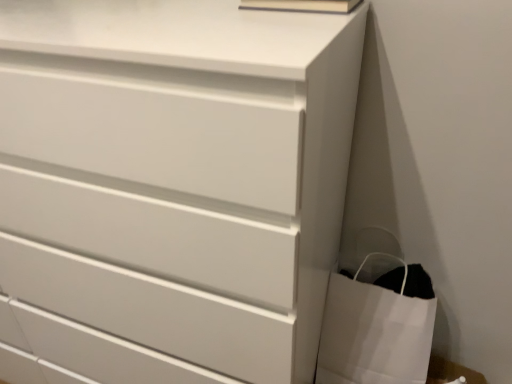
Question: Is white paper bag at lower right inside or outside of white matte chest of drawers at center?

Choices:
 (A) inside
 (B) outside

Answer: (B)

Question: Looking at the image, does white paper bag at lower right seem bigger or smaller compared to white matte chest of drawers at center?

Choices:
 (A) big
 (B) small

Answer: (B)

Question: Is white paper bag at lower right in front of or behind white matte chest of drawers at center in the image?

Choices:
 (A) behind
 (B) front

Answer: (A)

Question: From a real-world perspective, relative to white paper bag at lower right, is white matte chest of drawers at center vertically above or below?

Choices:
 (A) above
 (B) below

Answer: (A)

Question: Looking at the image, does white matte chest of drawers at center seem bigger or smaller compared to white paper bag at lower right?

Choices:
 (A) big
 (B) small

Answer: (A)

Question: From their relative heights in the image, would you say white matte chest of drawers at center is taller or shorter than white paper bag at lower right?

Choices:
 (A) tall
 (B) short

Answer: (A)

Question: Do you think white matte chest of drawers at center is within white paper bag at lower right, or outside of it?

Choices:
 (A) inside
 (B) outside

Answer: (B)